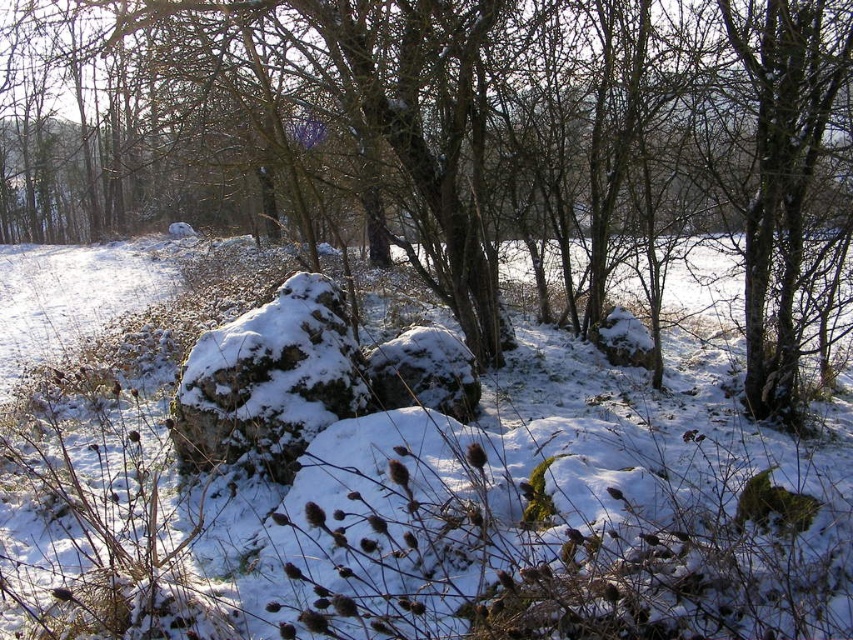
You are standing in the winter landscape described. You need to locate the brown rough tree at center. Where is it positioned in terms of its 2D coordinates?

The brown rough tree at center is located at the 2D coordinates point (456,141).

You are a hiker trying to navigate through the winter landscape. You see the brown rough tree at center and the white fluffy snow at center. Which object would you choose to use as a landmark for navigation, and why?

The brown rough tree at center is bigger than the white fluffy snow at center, so it would be a better landmark for navigation because its larger size makes it more visible and easier to identify from a distance.